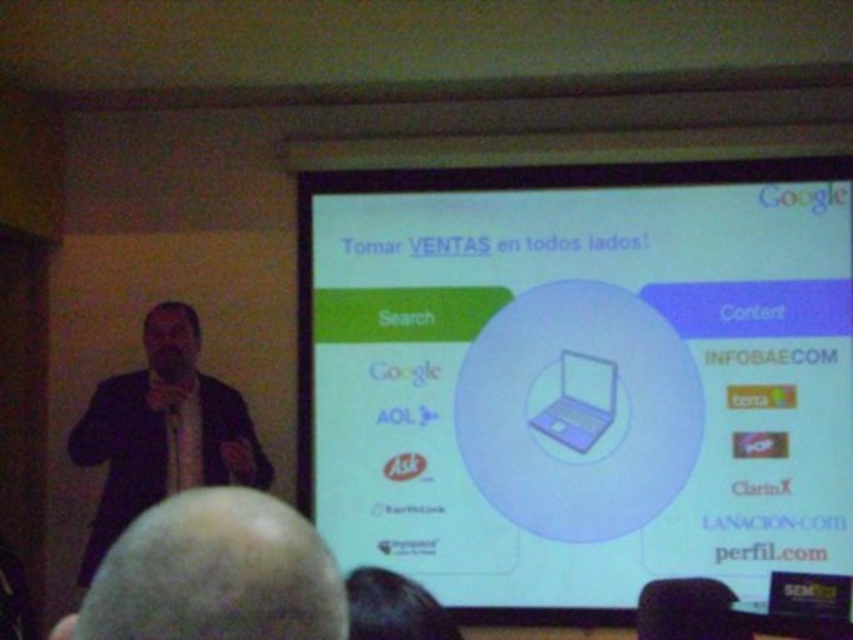
Looking at this image, can you confirm if smooth bald head at lower left is shorter than dark suit at left?

Answer: Yes.

Is point (169, 636) less distant than point (149, 314)?

Yes, it is in front of point (149, 314).

Who is more forward, (178, 556) or (160, 432)?

Positioned in front is point (178, 556).

I want to click on smooth bald head at lower left, so click(x=213, y=573).

Who is positioned more to the right, white glossy laptop at center or smooth bald head at lower left?

white glossy laptop at center is more to the right.

Does point (454, 504) come behind point (199, 614)?

That is True.

This screenshot has height=640, width=853. What are the coordinates of `white glossy laptop at center` in the screenshot? It's located at (578, 378).

Is white glossy laptop at center to the right of dark suit at left from the viewer's perspective?

Indeed, white glossy laptop at center is positioned on the right side of dark suit at left.

Does point (398, 490) come behind point (193, 332)?

Yes, point (398, 490) is farther from viewer.

Locate an element on the screen. white glossy laptop at center is located at coordinates (578, 378).